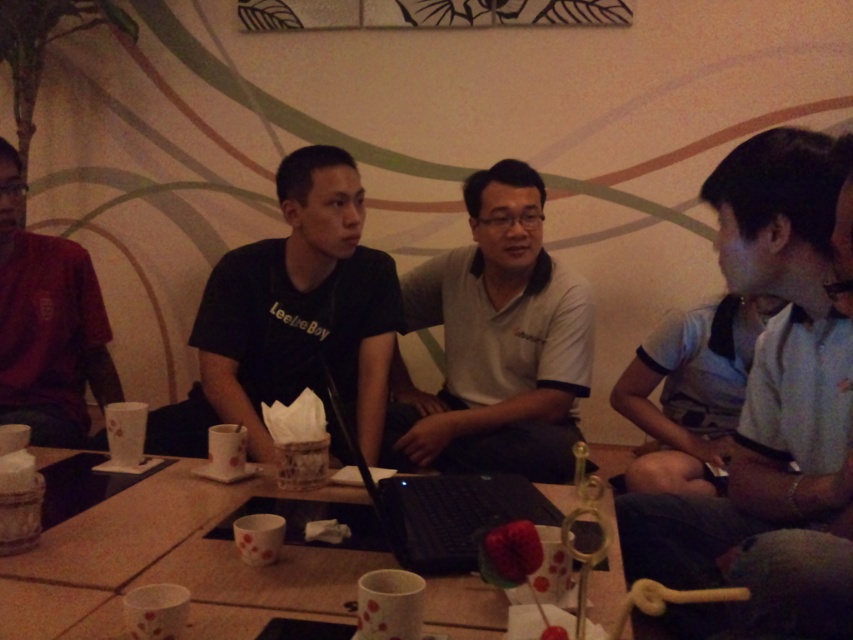
Question: Can you confirm if white matte shirt at center is thinner than dark red shirt at left?

Choices:
 (A) no
 (B) yes

Answer: (A)

Question: Which of the following is the closest to the observer?

Choices:
 (A) click(392, 432)
 (B) click(329, 387)
 (C) click(809, 211)

Answer: (C)

Question: Is white cotton shirt at right to the right of dark red shirt at left from the viewer's perspective?

Choices:
 (A) yes
 (B) no

Answer: (A)

Question: Estimate the real-world distances between objects in this image. Which object is closer to the white paper cup at center?

Choices:
 (A) black matte laptop at center
 (B) white cotton shirt at right

Answer: (A)

Question: Among these objects, which one is nearest to the camera?

Choices:
 (A) dark red shirt at left
 (B) white matte shirt at center

Answer: (A)

Question: Does black matte shirt at center have a greater width compared to black matte laptop at center?

Choices:
 (A) no
 (B) yes

Answer: (B)